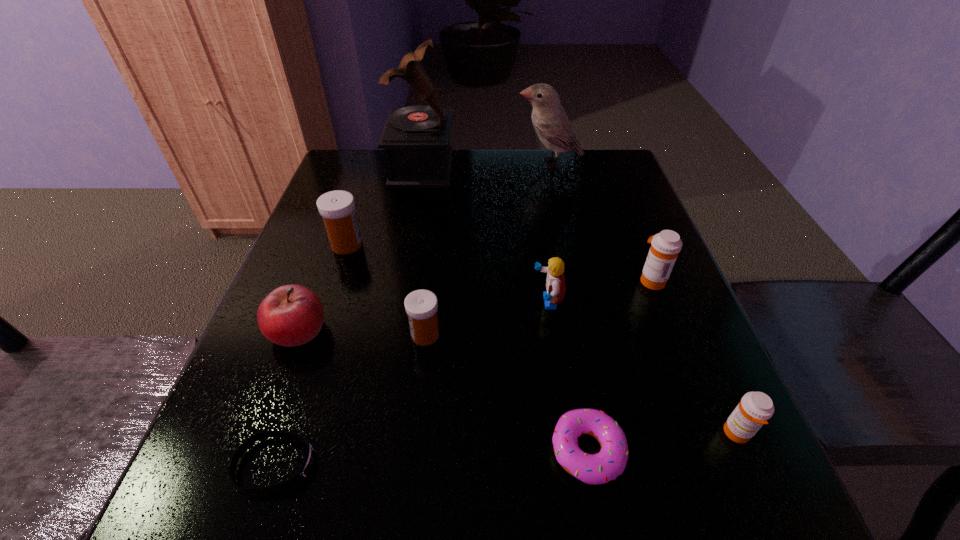
Find the location of `phonograph_record that is at the far edge`. phonograph_record that is at the far edge is located at coordinates (416, 139).

This screenshot has height=540, width=960. I want to click on bird located at the far edge, so click(x=550, y=121).

The height and width of the screenshot is (540, 960). I want to click on doughnut positioned at the near edge, so click(x=610, y=462).

Find the location of a particular element. Image resolution: width=960 pixels, height=540 pixels. wristband present at the near edge is located at coordinates (309, 458).

Locate an element on the screen. This screenshot has width=960, height=540. phonograph_record present at the left edge is located at coordinates (416, 139).

Locate an element on the screen. Image resolution: width=960 pixels, height=540 pixels. medicine at the left edge is located at coordinates (337, 208).

Locate an element on the screen. This screenshot has width=960, height=540. apple present at the left edge is located at coordinates (291, 315).

Image resolution: width=960 pixels, height=540 pixels. Identify the location of wristband present at the left edge. (309, 458).

Find the location of a particular element. The height and width of the screenshot is (540, 960). bird that is at the right edge is located at coordinates (550, 121).

Locate an element on the screen. This screenshot has width=960, height=540. object situated at the far left corner is located at coordinates (416, 139).